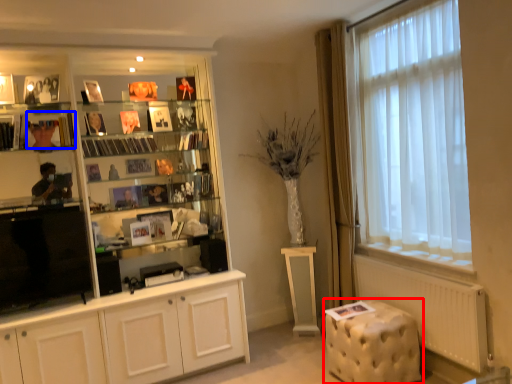
Question: Which of the following is the closest to the observer, music stool (highlighted by a red box) or book (highlighted by a blue box)?

Choices:
 (A) music stool
 (B) book

Answer: (A)